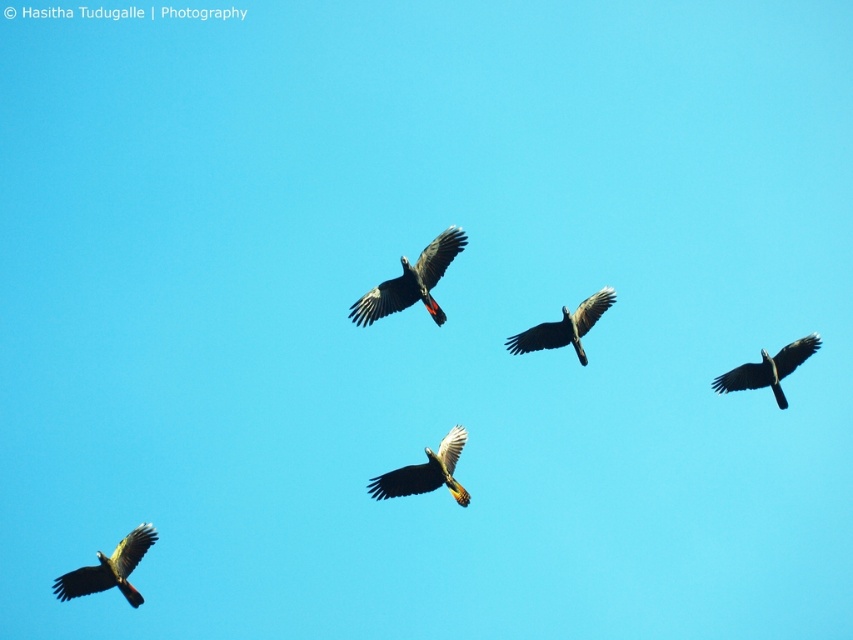
Question: Which of the following is the closest to the observer?

Choices:
 (A) black glossy parrot at center
 (B) shiny green parrot at bottom left
 (C) black glossy eagle at upper right
 (D) yellow-green feathers at center

Answer: (A)

Question: Which point is closer to the camera taking this photo?

Choices:
 (A) (447, 252)
 (B) (595, 308)

Answer: (A)

Question: Among these points, which one is farthest from the camera?

Choices:
 (A) (115, 566)
 (B) (447, 456)

Answer: (A)

Question: Does yellow-green feathers at center appear under black glossy eagle at center?

Choices:
 (A) no
 (B) yes

Answer: (B)

Question: Does shiny green parrot at bottom left have a greater width compared to black glossy eagle at upper right?

Choices:
 (A) yes
 (B) no

Answer: (A)

Question: Does shiny green parrot at bottom left appear on the left side of yellow-green feathers at center?

Choices:
 (A) no
 (B) yes

Answer: (B)